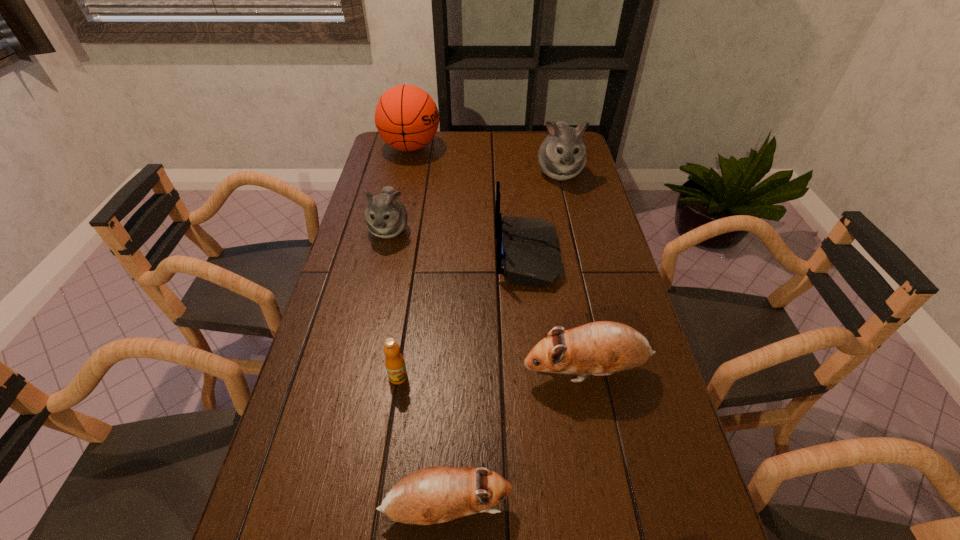
Locate which object is the closest to the black router. Please provide its 2D coordinates. Your answer should be formatted as a tuple, i.e. [(x, y)], where the tuple contains the x and y coordinates of a point satisfying the conditions above.

[(562, 155)]

Locate an element on the screen. the second closest object relative to the basketball is located at coordinates (562, 155).

Locate an element on the screen. Image resolution: width=960 pixels, height=540 pixels. hamster identified as the second closest to the basketball is located at coordinates (562, 155).

Where is `hamster that is the third closest to the bigger white hamster`? The height and width of the screenshot is (540, 960). hamster that is the third closest to the bigger white hamster is located at coordinates (431, 495).

Identify which brown hamster is the second nearest to the orange juice. Please provide its 2D coordinates. Your answer should be formatted as a tuple, i.e. [(x, y)], where the tuple contains the x and y coordinates of a point satisfying the conditions above.

[(601, 348)]

Where is `free spot that satisfies the following two spatial constraints: 1. at the face of the right brown hamster; 2. on the front label of the orange juice`? This screenshot has width=960, height=540. free spot that satisfies the following two spatial constraints: 1. at the face of the right brown hamster; 2. on the front label of the orange juice is located at coordinates (588, 377).